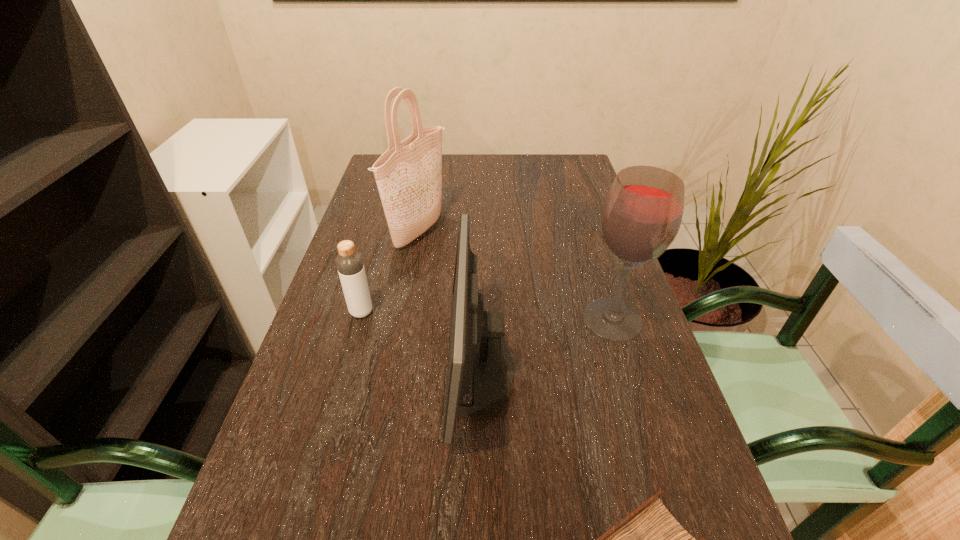
Identify the location of shopping bag. Image resolution: width=960 pixels, height=540 pixels. (409, 174).

Find the location of a particular element. The height and width of the screenshot is (540, 960). alcohol is located at coordinates (641, 215).

Find the location of a particular element. computer monitor is located at coordinates (476, 338).

This screenshot has width=960, height=540. I want to click on bottle, so (x=349, y=262).

The image size is (960, 540). I want to click on vacant region located 0.400m on the right of the farthest object, so click(x=588, y=231).

Image resolution: width=960 pixels, height=540 pixels. In order to click on free space located 0.180m on the back of the alcohol in this screenshot , I will do `click(591, 251)`.

You are a GUI agent. You are given a task and a screenshot of the screen. Output one action in this format:
    pyautogui.click(x=<x>, y=<y>)
    Task: Click on the vacant space located on the screen side of the computer monitor
    The width and height of the screenshot is (960, 540).
    Given the screenshot: What is the action you would take?
    pyautogui.click(x=309, y=369)

You are a GUI agent. You are given a task and a screenshot of the screen. Output one action in this format:
    pyautogui.click(x=<x>, y=<y>)
    Task: Click on the vacant area situated on the screen side of the computer monitor
    The image size is (960, 540).
    Given the screenshot: What is the action you would take?
    pyautogui.click(x=389, y=369)

I want to click on free region located on the screen side of the computer monitor, so click(x=309, y=369).

This screenshot has width=960, height=540. What are the coordinates of `blank space located on the back of the shortest object` in the screenshot? It's located at (374, 266).